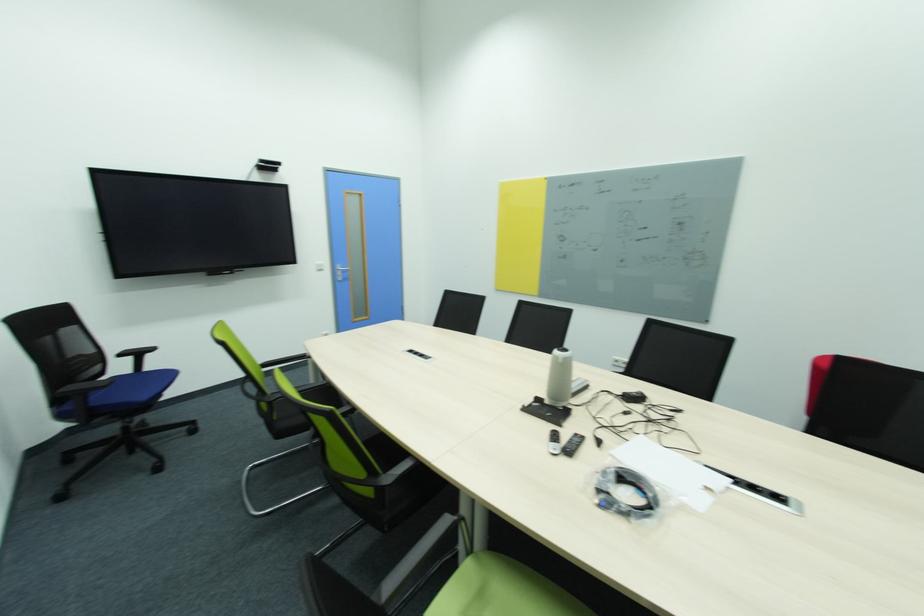
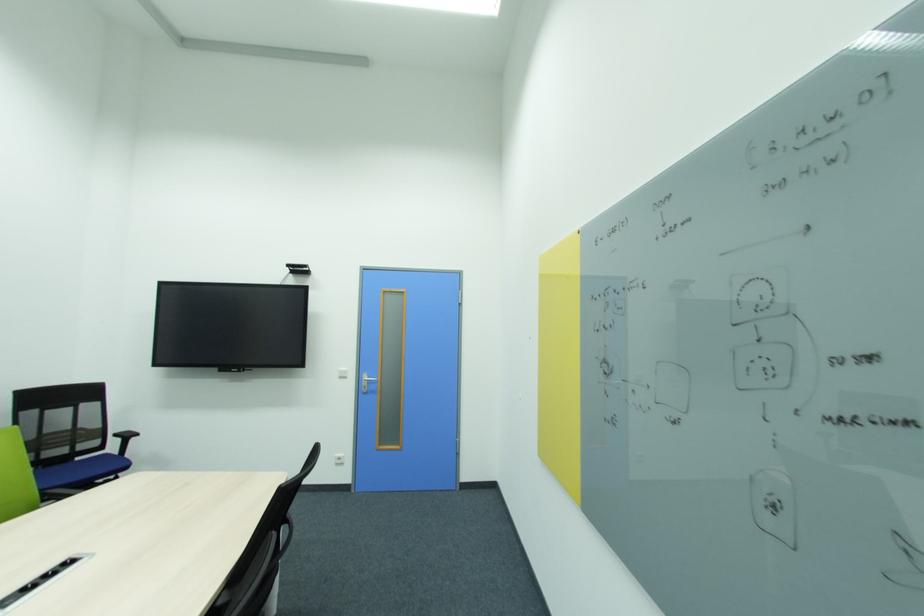
Where in the second image is the point corresponding to pixel 344 280 from the first image?

(370, 392)